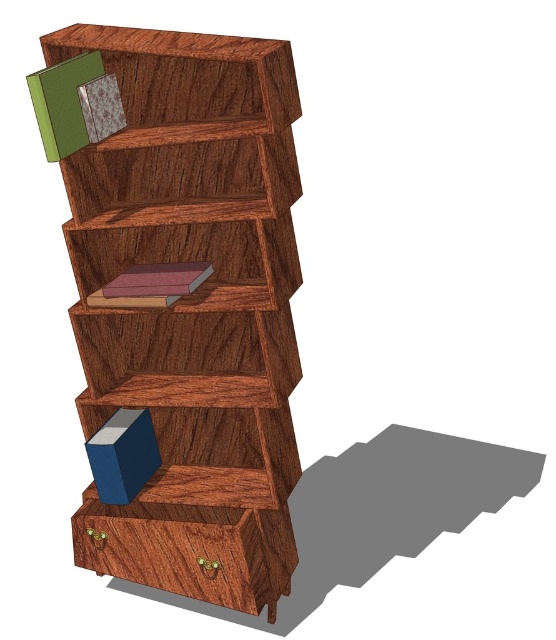
Who is positioned more to the left, wooden drawer at lower center or green matte book at upper left?

green matte book at upper left

Who is higher up, wooden drawer at lower center or green matte book at upper left?

green matte book at upper left

This screenshot has width=556, height=640. Describe the element at coordinates (176, 548) in the screenshot. I see `wooden drawer at lower center` at that location.

The height and width of the screenshot is (640, 556). What are the coordinates of `wooden drawer at lower center` in the screenshot? It's located at (x=176, y=548).

Is blue matte book at lower center below matte pink book at center?

Yes.

Who is higher up, blue matte book at lower center or matte pink book at center?

matte pink book at center is higher up.

Which is behind, point (156, 467) or point (173, 282)?

The point (156, 467) is more distant.

Find the location of a particular element. The height and width of the screenshot is (640, 556). blue matte book at lower center is located at coordinates (122, 456).

Which is behind, point (126, 576) or point (257, 225)?

The point (126, 576) is more distant.

Which is below, wooden drawer at lower center or wooden bookshelf at center?

wooden drawer at lower center is below.

Describe the element at coordinates (176, 548) in the screenshot. This screenshot has height=640, width=556. I see `wooden drawer at lower center` at that location.

The height and width of the screenshot is (640, 556). What are the coordinates of `wooden drawer at lower center` in the screenshot? It's located at (176, 548).